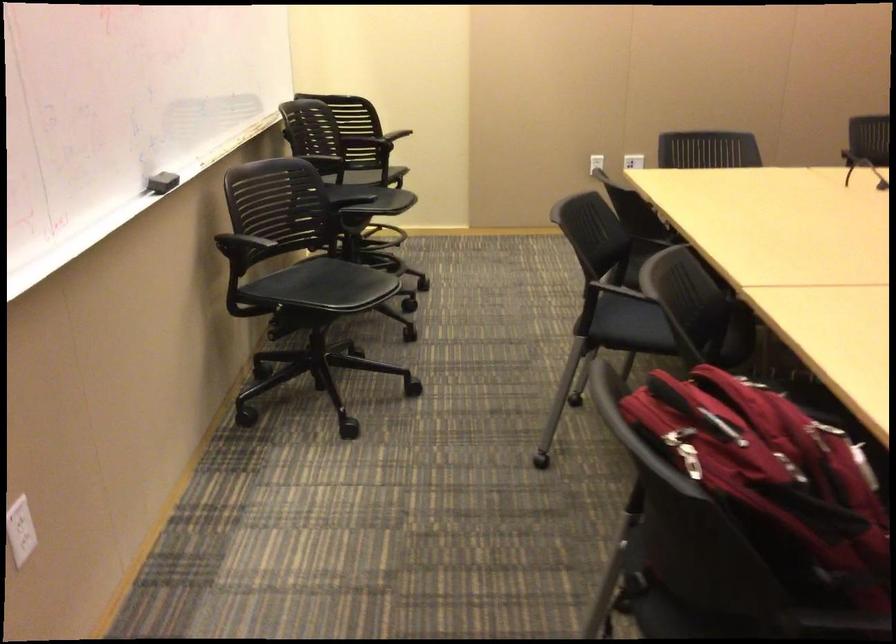
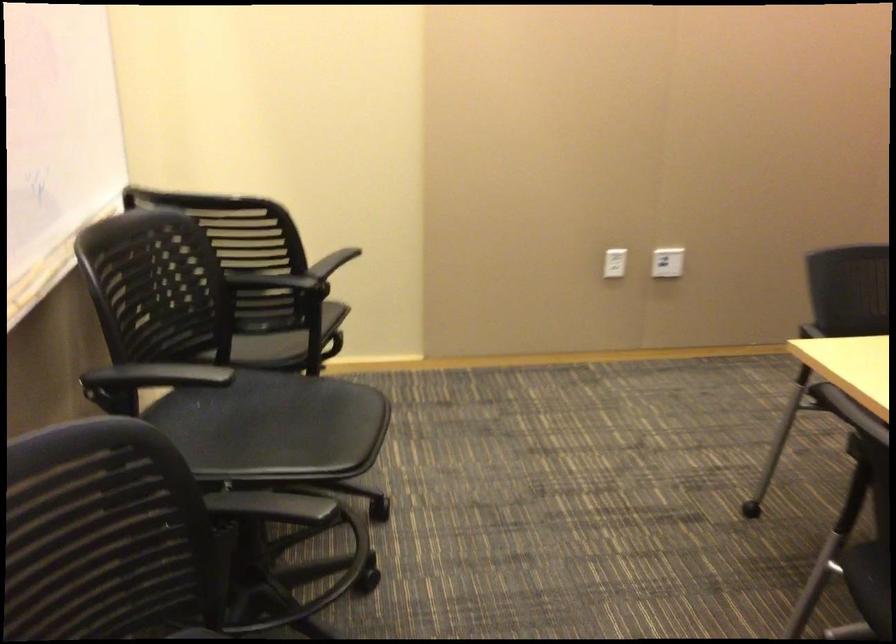
The point at (645, 160) is marked in the first image. Where is the corresponding point in the second image?

(667, 261)